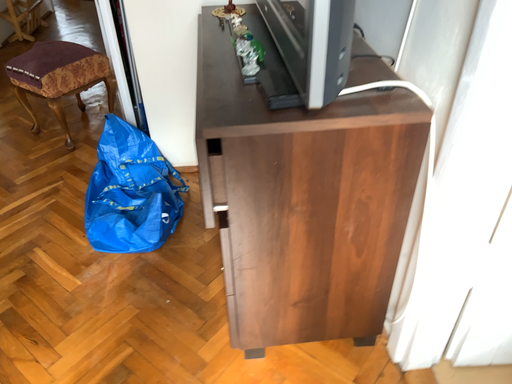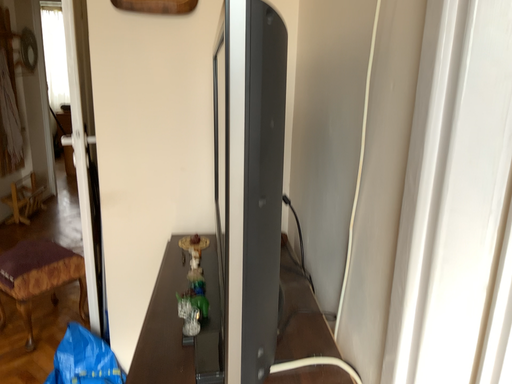
Question: How did the camera likely rotate when shooting the video?

Choices:
 (A) rotated downward
 (B) rotated upward

Answer: (B)